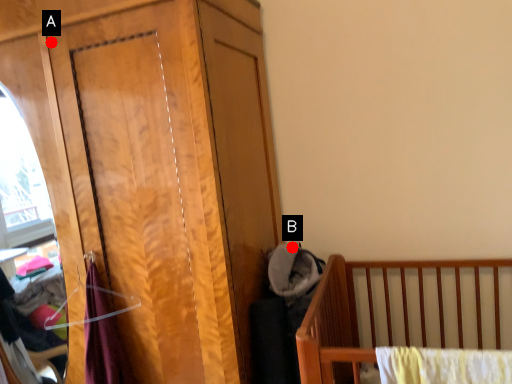
Question: Two points are circled on the image, labeled by A and B beside each circle. Which point is closer to the camera?

Choices:
 (A) A is closer
 (B) B is closer

Answer: (A)